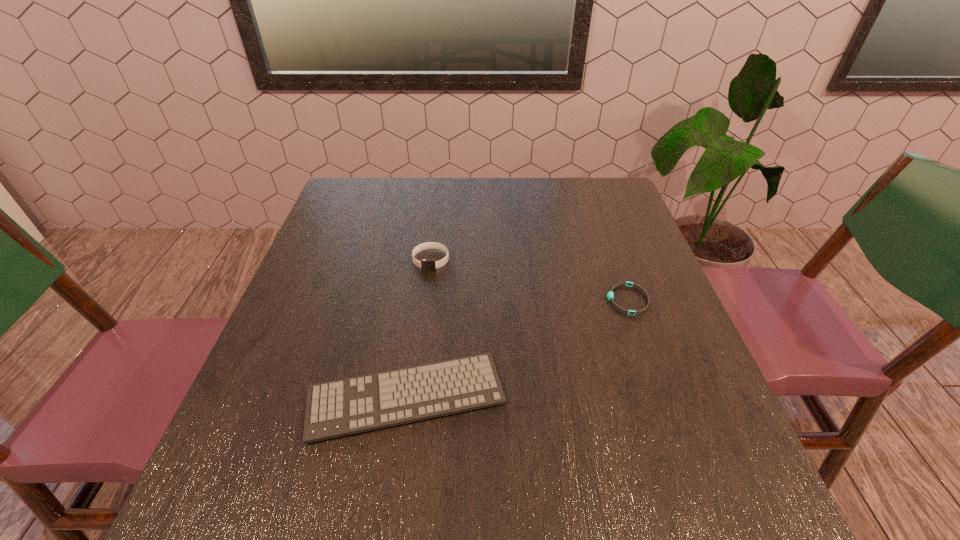
This screenshot has width=960, height=540. Identify the location of empty space between the nearest object and the farther wristband. (419, 328).

The width and height of the screenshot is (960, 540). In order to click on empty location between the left wristband and the shorter wristband in this screenshot , I will do `click(529, 280)`.

You are a GUI agent. You are given a task and a screenshot of the screen. Output one action in this format:
    pyautogui.click(x=<x>, y=<y>)
    Task: Click on the free area in between the taller wristband and the nearest object
    
    Given the screenshot: What is the action you would take?
    tap(419, 328)

You are a GUI agent. You are given a task and a screenshot of the screen. Output one action in this format:
    pyautogui.click(x=<x>, y=<y>)
    Task: Click on the free point between the second tallest object and the shortest object
    
    Given the screenshot: What is the action you would take?
    pyautogui.click(x=516, y=348)

Image resolution: width=960 pixels, height=540 pixels. I want to click on free space between the second farthest object and the farther wristband, so click(529, 280).

Where is `free space between the farthest object and the shorter wristband`? Image resolution: width=960 pixels, height=540 pixels. free space between the farthest object and the shorter wristband is located at coordinates (529, 280).

Locate an element on the screen. free space that is in between the rightmost object and the left wristband is located at coordinates (529, 280).

At what (x,y) coordinates should I click in order to perform the action: click on free space between the left wristband and the second tallest object. Please return your answer as a coordinate pair (x, y). Image resolution: width=960 pixels, height=540 pixels. Looking at the image, I should click on (419, 328).

At what (x,y) coordinates should I click in order to perform the action: click on vacant area between the left wristband and the nearer wristband. Please return your answer as a coordinate pair (x, y). The width and height of the screenshot is (960, 540). Looking at the image, I should click on (529, 280).

Identify the location of object identified as the second closest to the right wristband. Image resolution: width=960 pixels, height=540 pixels. (426, 264).